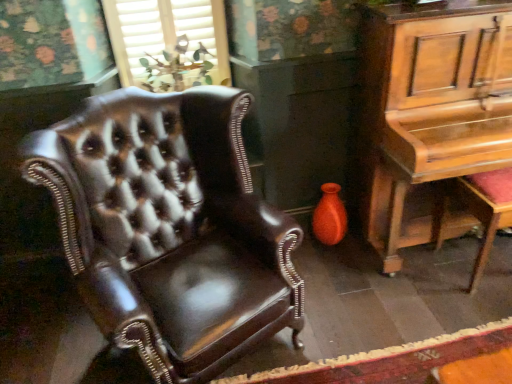
Question: Is matte orange vase at lower right not near shiny brown leather armchair at left?

Choices:
 (A) yes
 (B) no

Answer: (B)

Question: Can you confirm if matte orange vase at lower right is thinner than shiny brown leather armchair at left?

Choices:
 (A) yes
 (B) no

Answer: (A)

Question: From the image's perspective, would you say matte orange vase at lower right is shown under shiny brown leather armchair at left?

Choices:
 (A) yes
 (B) no

Answer: (B)

Question: Does matte orange vase at lower right have a greater width compared to shiny brown leather armchair at left?

Choices:
 (A) yes
 (B) no

Answer: (B)

Question: Does matte orange vase at lower right have a greater height compared to shiny brown leather armchair at left?

Choices:
 (A) yes
 (B) no

Answer: (B)

Question: Considering the relative sizes of matte orange vase at lower right and shiny brown leather armchair at left in the image provided, is matte orange vase at lower right shorter than shiny brown leather armchair at left?

Choices:
 (A) no
 (B) yes

Answer: (B)

Question: Is red cushioned stool at right not close to matte wood window at upper center?

Choices:
 (A) yes
 (B) no

Answer: (A)

Question: From the image's perspective, is red cushioned stool at right beneath matte wood window at upper center?

Choices:
 (A) no
 (B) yes

Answer: (B)

Question: Considering the relative sizes of red cushioned stool at right and matte wood window at upper center in the image provided, is red cushioned stool at right bigger than matte wood window at upper center?

Choices:
 (A) no
 (B) yes

Answer: (B)

Question: Is red cushioned stool at right turned away from matte wood window at upper center?

Choices:
 (A) no
 (B) yes

Answer: (A)

Question: Considering the relative sizes of red cushioned stool at right and matte wood window at upper center in the image provided, is red cushioned stool at right smaller than matte wood window at upper center?

Choices:
 (A) yes
 (B) no

Answer: (B)

Question: Is red cushioned stool at right surrounding matte wood window at upper center?

Choices:
 (A) no
 (B) yes

Answer: (A)

Question: From a real-world perspective, is shiny brown leather armchair at left located higher than red cushioned stool at right?

Choices:
 (A) yes
 (B) no

Answer: (A)